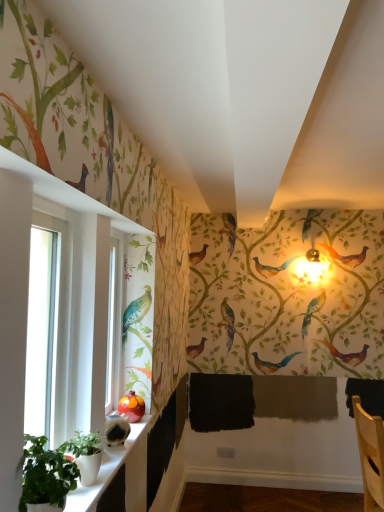
Where is `white ceramic window sill at lower left`? This screenshot has height=512, width=384. white ceramic window sill at lower left is located at coordinates (104, 472).

Identify the location of window on the left of the green matte plant at lower left, which is the 2th plant from back to front. The height and width of the screenshot is (512, 384). (58, 307).

From the image's perspective, between green matte plant at lower left, which is the 2th plant from back to front, and clear glass window at left, which one is located above?

clear glass window at left appears higher in the image.

Is green matte plant at lower left, which is the 2th plant from back to front, completely or partially outside of clear glass window at left?

green matte plant at lower left, which is the 2th plant from back to front, is positioned outside clear glass window at left.

From the picture: From the image's perspective, between white ceramic window sill at lower left and green matte plant at lower left, which is the 2th plant from back to front, which one is located above?

green matte plant at lower left, which is the 2th plant from back to front, appears higher in the image.

Between white ceramic window sill at lower left and green matte plant at lower left, which is the 2th plant from back to front, which one appears on the right side from the viewer's perspective?

From the viewer's perspective, white ceramic window sill at lower left appears more on the right side.

You are a GUI agent. You are given a task and a screenshot of the screen. Output one action in this format:
    pyautogui.click(x=<x>, y=<y>)
    Task: Click on the window sill below the green matte plant at lower left, which is the 2th plant from back to front (from the image's perspective)
    
    Given the screenshot: What is the action you would take?
    pyautogui.click(x=104, y=472)

Is green matte plant at lower left, positioned as the 1th plant in back-to-front order, facing away from green matte plant at lower left, acting as the 1th plant starting from the front?

That's not correct — green matte plant at lower left, positioned as the 1th plant in back-to-front order, is not looking away from green matte plant at lower left, acting as the 1th plant starting from the front.

Are green matte plant at lower left, positioned as the 1th plant in back-to-front order, and green matte plant at lower left, acting as the 1th plant starting from the front, making contact?

No, green matte plant at lower left, positioned as the 1th plant in back-to-front order, is not touching green matte plant at lower left, acting as the 1th plant starting from the front.

Is green matte plant at lower left, positioned as the 1th plant in back-to-front order, shorter than green matte plant at lower left, which is the 2th plant from back to front?

Correct, green matte plant at lower left, positioned as the 1th plant in back-to-front order, is not as tall as green matte plant at lower left, which is the 2th plant from back to front.

How much distance is there between green matte plant at lower left, positioned as the 1th plant in back-to-front order, and green matte plant at lower left, which is the 2th plant from back to front?

A distance of 6.24 inches exists between green matte plant at lower left, positioned as the 1th plant in back-to-front order, and green matte plant at lower left, which is the 2th plant from back to front.

From a real-world perspective, is green matte plant at lower left, acting as the second plant starting from the front, located higher than white ceramic window sill at lower left?

Yes, from a real-world perspective, green matte plant at lower left, acting as the second plant starting from the front, is over white ceramic window sill at lower left

Can white ceramic window sill at lower left be found inside green matte plant at lower left, positioned as the 1th plant in back-to-front order?

No, green matte plant at lower left, positioned as the 1th plant in back-to-front order, does not contain white ceramic window sill at lower left.

Which of these two, green matte plant at lower left, acting as the second plant starting from the front, or white ceramic window sill at lower left, is thinner?

green matte plant at lower left, acting as the second plant starting from the front.

Is green matte plant at lower left, acting as the second plant starting from the front, positioned with its back to white ceramic window sill at lower left?

No.

From their relative heights in the image, would you say white ceramic window sill at lower left is taller or shorter than green matte plant at lower left, positioned as the 1th plant in back-to-front order?

Clearly, white ceramic window sill at lower left is shorter compared to green matte plant at lower left, positioned as the 1th plant in back-to-front order.

Looking at the image, does white ceramic window sill at lower left seem bigger or smaller compared to green matte plant at lower left, positioned as the 1th plant in back-to-front order?

Considering their sizes, white ceramic window sill at lower left takes up more space than green matte plant at lower left, positioned as the 1th plant in back-to-front order.

Considering the positions of objects white ceramic window sill at lower left and green matte plant at lower left, positioned as the 1th plant in back-to-front order, in the image provided, who is behind, white ceramic window sill at lower left or green matte plant at lower left, positioned as the 1th plant in back-to-front order,?

green matte plant at lower left, positioned as the 1th plant in back-to-front order.

From the image's perspective, is clear glass window at left below green matte plant at lower left, positioned as the 1th plant in back-to-front order?

Actually, clear glass window at left appears above green matte plant at lower left, positioned as the 1th plant in back-to-front order, in the image.

How different are the orientations of clear glass window at left and green matte plant at lower left, positioned as the 1th plant in back-to-front order, in degrees?

clear glass window at left and green matte plant at lower left, positioned as the 1th plant in back-to-front order, are facing 6.67 degrees away from each other.

Is green matte plant at lower left, acting as the second plant starting from the front, completely or partially inside clear glass window at left?

No, clear glass window at left does not contain green matte plant at lower left, acting as the second plant starting from the front.

Is clear glass window at left wider than green matte plant at lower left, acting as the second plant starting from the front?

Yes.

Does clear glass window at left appear on the right side of green matte plant at lower left, acting as the 1th plant starting from the front?

No, clear glass window at left is not to the right of green matte plant at lower left, acting as the 1th plant starting from the front.

Are clear glass window at left and green matte plant at lower left, which is the 2th plant from back to front, beside each other?

No, clear glass window at left is not making contact with green matte plant at lower left, which is the 2th plant from back to front.

Does point (70, 313) lie in front of point (36, 442)?

No, it is not.

This screenshot has width=384, height=512. What are the coordinates of `window on the left side of green matte plant at lower left, which is the 2th plant from back to front` in the screenshot? It's located at (58, 307).

Where is `window above the green matte plant at lower left, which is the 2th plant from back to front (from a real-world perspective)`? This screenshot has width=384, height=512. window above the green matte plant at lower left, which is the 2th plant from back to front (from a real-world perspective) is located at coordinates (58, 307).

Find the location of a particular element. The height and width of the screenshot is (512, 384). window sill to the right of green matte plant at lower left, which is the 2th plant from back to front is located at coordinates (104, 472).

Based on their spatial positions, is clear glass window at left or green matte plant at lower left, positioned as the 1th plant in back-to-front order, further from green matte plant at lower left, acting as the 1th plant starting from the front?

The object further to green matte plant at lower left, acting as the 1th plant starting from the front, is clear glass window at left.

Considering their positions, is green matte plant at lower left, positioned as the 1th plant in back-to-front order, positioned closer to green matte plant at lower left, which is the 2th plant from back to front, than clear glass window at left?

green matte plant at lower left, positioned as the 1th plant in back-to-front order, lies closer to green matte plant at lower left, which is the 2th plant from back to front, than the other object.

Based on their spatial positions, is clear glass window at left or green matte plant at lower left, acting as the 1th plant starting from the front, closer to white ceramic window sill at lower left?

The object closer to white ceramic window sill at lower left is green matte plant at lower left, acting as the 1th plant starting from the front.

From the image, which object appears to be farther from green matte plant at lower left, positioned as the 1th plant in back-to-front order, green matte plant at lower left, acting as the 1th plant starting from the front, or clear glass window at left?

Among the two, clear glass window at left is located further to green matte plant at lower left, positioned as the 1th plant in back-to-front order.

From the image, which object appears to be nearer to clear glass window at left, white ceramic window sill at lower left or green matte plant at lower left, positioned as the 1th plant in back-to-front order?

green matte plant at lower left, positioned as the 1th plant in back-to-front order, is closer to clear glass window at left.

Which object lies nearer to the anchor point green matte plant at lower left, which is the 2th plant from back to front, white ceramic window sill at lower left or green matte plant at lower left, positioned as the 1th plant in back-to-front order?

green matte plant at lower left, positioned as the 1th plant in back-to-front order, is closer to green matte plant at lower left, which is the 2th plant from back to front.

From the image, which object appears to be nearer to green matte plant at lower left, positioned as the 1th plant in back-to-front order, white ceramic window sill at lower left or green matte plant at lower left, which is the 2th plant from back to front?

Among the two, white ceramic window sill at lower left is located nearer to green matte plant at lower left, positioned as the 1th plant in back-to-front order.

Considering their positions, is green matte plant at lower left, which is the 2th plant from back to front, positioned closer to clear glass window at left than green matte plant at lower left, acting as the second plant starting from the front?

green matte plant at lower left, which is the 2th plant from back to front.

Find the location of a particular element. plant that lies between clear glass window at left and green matte plant at lower left, acting as the second plant starting from the front, from top to bottom is located at coordinates (45, 475).

Where is `window sill positioned between green matte plant at lower left, which is the 2th plant from back to front, and green matte plant at lower left, acting as the second plant starting from the front, from near to far`? The image size is (384, 512). window sill positioned between green matte plant at lower left, which is the 2th plant from back to front, and green matte plant at lower left, acting as the second plant starting from the front, from near to far is located at coordinates (104, 472).